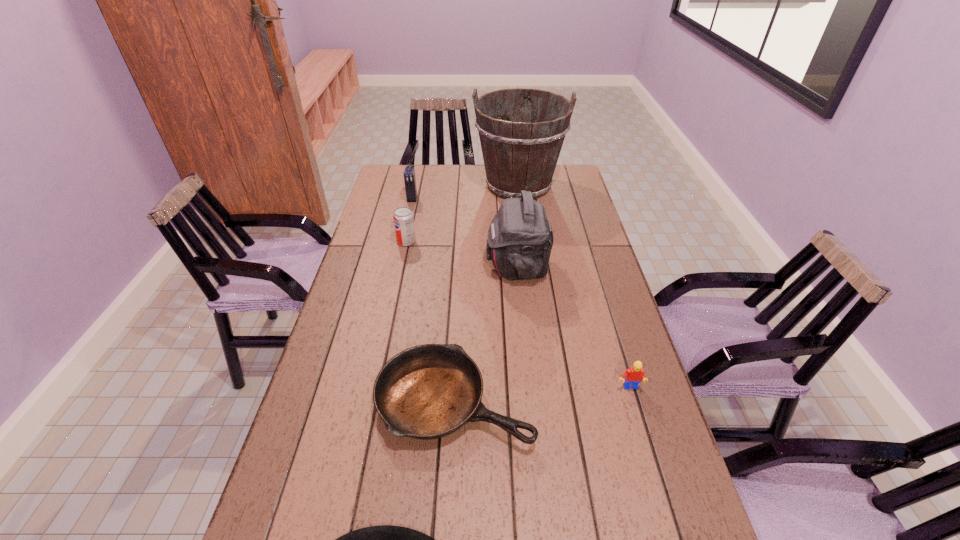
Find the location of a particular element. This screenshot has height=540, width=960. vacant space situated with the zip open on the clutch bag is located at coordinates (398, 266).

At what (x,y) coordinates should I click in order to perform the action: click on free space located 0.260m on the back of the soda. Please return your answer as a coordinate pair (x, y). This screenshot has width=960, height=540. Looking at the image, I should click on (416, 198).

In order to click on blank space located on the front-facing side of the Lego in this screenshot , I will do `click(667, 514)`.

Find the location of `vacant space located 0.140m on the right of the shortest object`. vacant space located 0.140m on the right of the shortest object is located at coordinates (589, 400).

Where is `object positioned at the far edge`? This screenshot has width=960, height=540. object positioned at the far edge is located at coordinates (522, 155).

This screenshot has width=960, height=540. In order to click on clutch bag present at the left edge in this screenshot , I will do `click(409, 173)`.

Where is `soda present at the left edge`? The width and height of the screenshot is (960, 540). soda present at the left edge is located at coordinates (403, 218).

Where is `bucket that is at the right edge`? Image resolution: width=960 pixels, height=540 pixels. bucket that is at the right edge is located at coordinates (522, 155).

At what (x,y) coordinates should I click in order to perform the action: click on Lego positioned at the right edge. Please return your answer as a coordinate pair (x, y). The image size is (960, 540). Looking at the image, I should click on point(634,375).

Where is `object that is positioned at the far right corner`? Image resolution: width=960 pixels, height=540 pixels. object that is positioned at the far right corner is located at coordinates (522, 155).